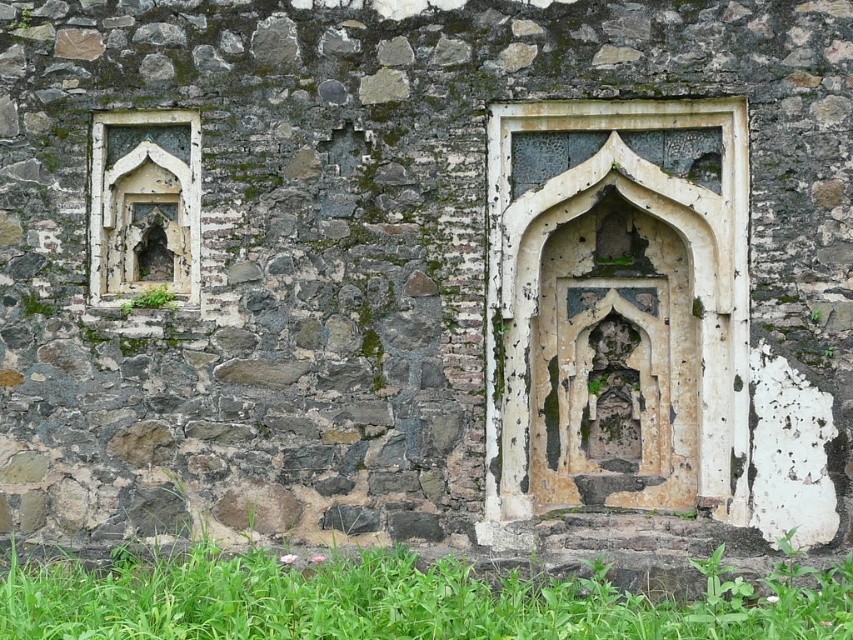
You are standing in front of the stone wall with two arched niches. There is a point marked at coordinates (403, 600). Based on the scene, what is located at this point?

The point at coordinates (403, 600) indicates green grass at lower center.

You are standing in front of the weathered stone wall. You see a white stone arch at center and a green leafy weed at lower left. Which object is positioned to the right of the other?

The white stone arch at center is to the right of the green leafy weed at lower left.